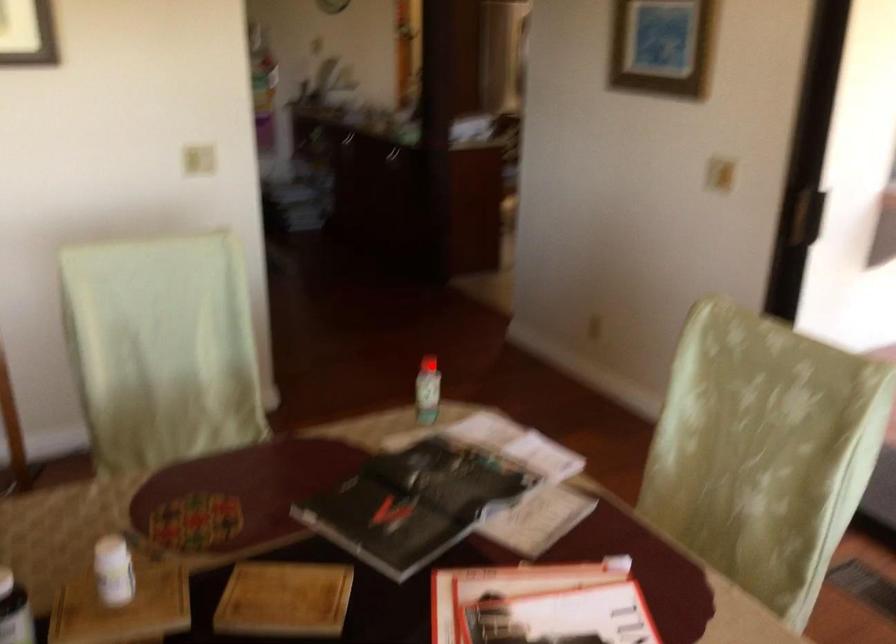
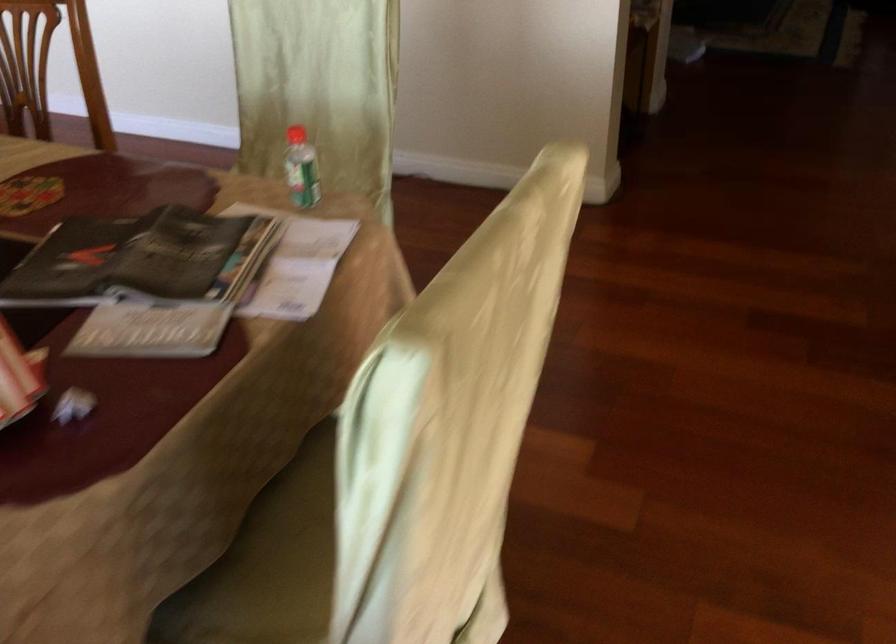
Question: I am providing you with two images of the same scene from different viewpoints. Image1 has a red point marked. In image2, the corresponding 3D location appears at what relative position? Reply with the corresponding letter.

Choices:
 (A) Closer
 (B) Farther

Answer: (A)